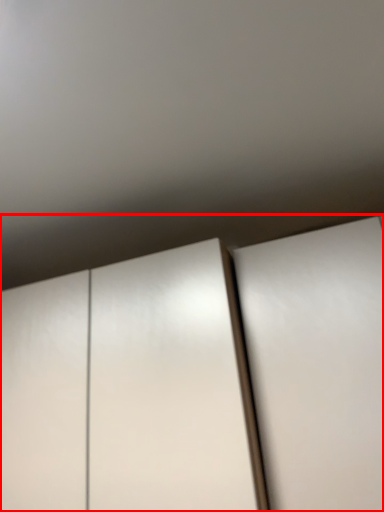
Question: From the image's perspective, where is cupboard (annotated by the red box) located in relation to door in the image?

Choices:
 (A) above
 (B) below

Answer: (B)